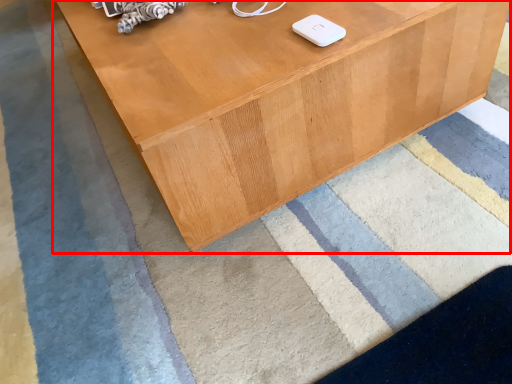
Question: From the image's perspective, what is the correct spatial relationship of table (annotated by the red box) in relation to ipod?

Choices:
 (A) above
 (B) below

Answer: (A)